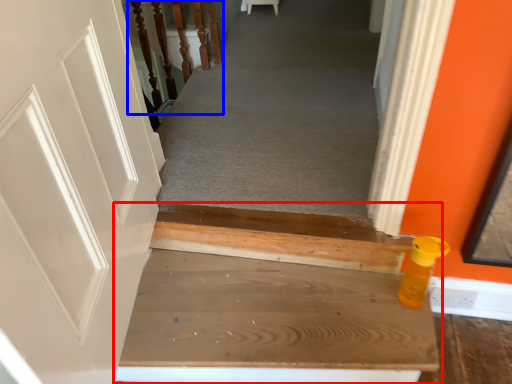
Question: Which of the following is the farthest to the observer, stairs (highlighted by a red box) or rail (highlighted by a blue box)?

Choices:
 (A) stairs
 (B) rail

Answer: (B)